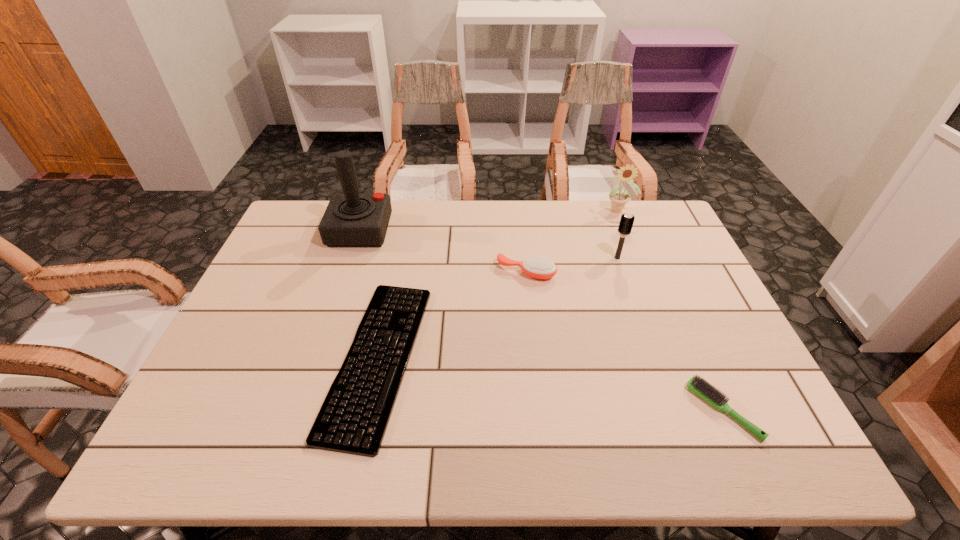
Locate an element on the screen. This screenshot has height=540, width=960. vacant space at the near left corner is located at coordinates (239, 435).

The height and width of the screenshot is (540, 960). In the image, there is a desktop. In order to click on vacant space at the far right corner in this screenshot , I will do `click(662, 213)`.

Locate an element on the screen. The width and height of the screenshot is (960, 540). free space that is in between the second hairbrush from right to left and the sunflower is located at coordinates (617, 234).

Image resolution: width=960 pixels, height=540 pixels. Identify the location of free space between the tallest hairbrush and the rightmost hairbrush. 670,334.

Find the location of a particular element. free spot between the shortest hairbrush and the second hairbrush from left to right is located at coordinates (670, 334).

Where is `vacant area that lies between the tallest hairbrush and the tallest object`? This screenshot has height=540, width=960. vacant area that lies between the tallest hairbrush and the tallest object is located at coordinates (489, 244).

This screenshot has width=960, height=540. In order to click on free space between the shortest object and the tallest object in this screenshot , I will do `click(369, 294)`.

What are the coordinates of `free space between the second tallest object and the tallest hairbrush` in the screenshot? It's located at (617, 234).

Where is `free space between the sunflower and the shortest hairbrush`? The height and width of the screenshot is (540, 960). free space between the sunflower and the shortest hairbrush is located at coordinates (671, 310).

At what (x,y) coordinates should I click in order to perform the action: click on free space between the second tallest hairbrush and the shortest object. Please return your answer as a coordinate pair (x, y). Looking at the image, I should click on (452, 315).